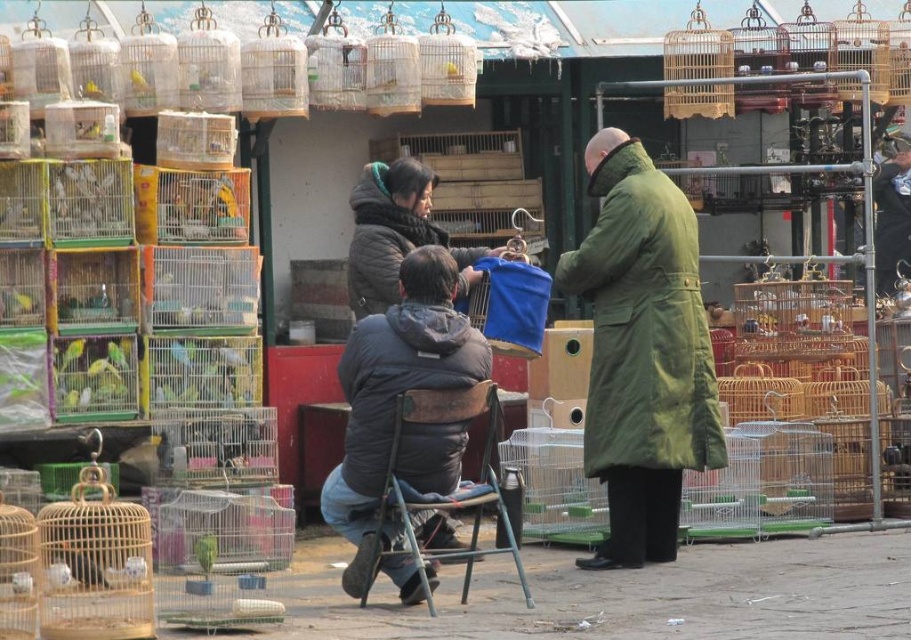
Who is positioned more to the right, dark gray fleece jacket at center or dark brown fur coat at center?

Positioned to the right is dark gray fleece jacket at center.

Is dark gray fleece jacket at center behind dark brown fur coat at center?

No, it is in front of dark brown fur coat at center.

Where is `dark gray fleece jacket at center`? The width and height of the screenshot is (911, 640). dark gray fleece jacket at center is located at coordinates (395, 388).

What do you see at coordinates (118, 353) in the screenshot?
I see `green matte birdcage at center` at bounding box center [118, 353].

This screenshot has height=640, width=911. I want to click on green matte birdcage at center, so click(x=118, y=353).

The width and height of the screenshot is (911, 640). What do you see at coordinates (118, 353) in the screenshot?
I see `green matte birdcage at center` at bounding box center [118, 353].

Where is `green matte birdcage at center`? The width and height of the screenshot is (911, 640). green matte birdcage at center is located at coordinates (118, 353).

Does dark brown fur coat at center appear under green matte birdcage at center?

Incorrect, dark brown fur coat at center is not positioned below green matte birdcage at center.

Which is in front, point (412, 163) or point (119, 355)?

Point (119, 355)

Image resolution: width=911 pixels, height=640 pixels. In order to click on dark brown fur coat at center in this screenshot , I will do `click(396, 234)`.